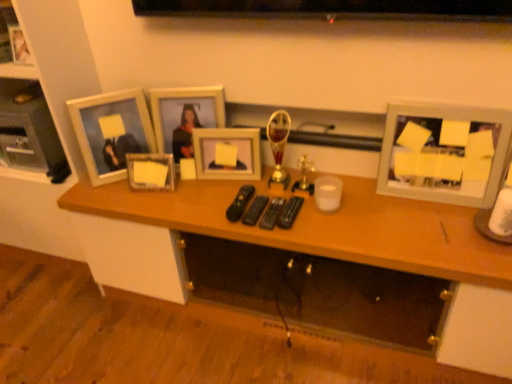
The width and height of the screenshot is (512, 384). What are the coordinates of `black plastic remote control at center, which appears as the 2th remote control when viewed from the left` in the screenshot? It's located at pyautogui.click(x=255, y=210).

The width and height of the screenshot is (512, 384). What do you see at coordinates (445, 153) in the screenshot? I see `white matte picture frame at upper right, which ranks as the 1th picture frame in right-to-left order` at bounding box center [445, 153].

The width and height of the screenshot is (512, 384). I want to click on white matte picture frame at upper right, which ranks as the 1th picture frame in right-to-left order, so click(x=445, y=153).

Image resolution: width=512 pixels, height=384 pixels. Describe the element at coordinates (228, 146) in the screenshot. I see `matte glass picture frame at center, positioned as the second picture frame in right-to-left order` at that location.

Identify the location of wooden picture frame at center, which is the third picture frame in left-to-right order. This screenshot has height=384, width=512. (150, 171).

What do you see at coordinates (185, 116) in the screenshot? This screenshot has height=384, width=512. I see `wooden photo frame at center, the 3th picture frame in the right-to-left sequence` at bounding box center [185, 116].

Locate an element on the screen. This screenshot has width=512, height=384. matte silver picture frame at upper left, acting as the 1th picture frame starting from the left is located at coordinates (19, 46).

Locate an element on the screen. black plastic remote control at center, which appears as the 2th remote control when viewed from the left is located at coordinates (255, 210).

Is white matte picture frame at upper right, which ranks as the 1th picture frame in right-to-left order, not close to white matte picture frame at upper left, the second picture frame viewed from the left?

white matte picture frame at upper right, which ranks as the 1th picture frame in right-to-left order, is actually quite close to white matte picture frame at upper left, the second picture frame viewed from the left.

Does white matte picture frame at upper right, which ranks as the sixth picture frame in left-to-right order, have a larger size compared to white matte picture frame at upper left, the second picture frame viewed from the left?

Indeed, white matte picture frame at upper right, which ranks as the sixth picture frame in left-to-right order, has a larger size compared to white matte picture frame at upper left, the second picture frame viewed from the left.

Does white matte picture frame at upper right, which ranks as the sixth picture frame in left-to-right order, have a greater width compared to white matte picture frame at upper left, the second picture frame viewed from the left?

Yes.

Which of these two, black plastic remote control at center, which is the third remote control from left to right, or wooden desk at center, is smaller?

With smaller size is black plastic remote control at center, which is the third remote control from left to right.

Between point (272, 229) and point (456, 256), which one is positioned behind?

The point (272, 229) is behind.

Based on the photo, from a real-world perspective, is black plastic remote control at center, the 2th remote control when ordered from right to left, over wooden desk at center?

Correct, in the physical world, black plastic remote control at center, the 2th remote control when ordered from right to left, is higher than wooden desk at center.

Consider the image. Considering the sizes of black plastic remote control at center, which is the third remote control from left to right, and wooden desk at center in the image, is black plastic remote control at center, which is the third remote control from left to right, taller or shorter than wooden desk at center?

black plastic remote control at center, which is the third remote control from left to right, is shorter than wooden desk at center.

From the image's perspective, between white matte picture frame at upper left, arranged as the fifth picture frame when viewed from the right, and black plastic remote control at center, placed as the fourth remote control when sorted from left to right, which one is located above?

From the image's view, white matte picture frame at upper left, arranged as the fifth picture frame when viewed from the right, is above.

Which object is further away from the camera taking this photo, white matte picture frame at upper left, the second picture frame viewed from the left, or black plastic remote control at center, which ranks as the 1th remote control in right-to-left order?

white matte picture frame at upper left, the second picture frame viewed from the left, is more distant.

How far apart are white matte picture frame at upper left, arranged as the fifth picture frame when viewed from the right, and black plastic remote control at center, placed as the fourth remote control when sorted from left to right?

white matte picture frame at upper left, arranged as the fifth picture frame when viewed from the right, is 26.92 inches away from black plastic remote control at center, placed as the fourth remote control when sorted from left to right.

Is white matte picture frame at upper left, arranged as the fifth picture frame when viewed from the right, looking in the opposite direction of black plastic remote control at center, which ranks as the 1th remote control in right-to-left order?

No.

Identify the location of the 2nd remote control to the right of the white matte picture frame at upper left, the second picture frame viewed from the left, starting your count from the anchor. (255, 210).

Consider the image. From a real-world perspective, relative to white matte picture frame at upper left, the second picture frame viewed from the left, is black plastic remote control at center, which appears as the 2th remote control when viewed from the left, vertically above or below?

black plastic remote control at center, which appears as the 2th remote control when viewed from the left, is situated lower than white matte picture frame at upper left, the second picture frame viewed from the left, in the real world.

Is black plastic remote control at center, which appears as the 2th remote control when viewed from the left, positioned before white matte picture frame at upper left, the second picture frame viewed from the left?

Yes, black plastic remote control at center, which appears as the 2th remote control when viewed from the left, is closer to the camera.

Considering the positions of objects matte silver picture frame at upper left, acting as the 1th picture frame starting from the left, and black glossy television at upper center in the image provided, who is more to the left, matte silver picture frame at upper left, acting as the 1th picture frame starting from the left, or black glossy television at upper center?

matte silver picture frame at upper left, acting as the 1th picture frame starting from the left.

The image size is (512, 384). What are the coordinates of `the 5th picture frame counting from the left side of the black glossy television at upper center` in the screenshot? It's located at (19, 46).

Do you think matte silver picture frame at upper left, acting as the 1th picture frame starting from the left, is within black glossy television at upper center, or outside of it?

matte silver picture frame at upper left, acting as the 1th picture frame starting from the left, exists outside the volume of black glossy television at upper center.

From the image's perspective, who appears lower, matte silver picture frame at upper left, acting as the 1th picture frame starting from the left, or black glossy television at upper center?

black glossy television at upper center, from the image's perspective.

Can you confirm if black plastic remote control at center, which appears as the 2th remote control when viewed from the left, is taller than white matte picture frame at upper right, which ranks as the 1th picture frame in right-to-left order?

In fact, black plastic remote control at center, which appears as the 2th remote control when viewed from the left, may be shorter than white matte picture frame at upper right, which ranks as the 1th picture frame in right-to-left order.

What's the angular difference between black plastic remote control at center, which is the third remote control in right-to-left order, and white matte picture frame at upper right, which ranks as the 1th picture frame in right-to-left order,'s facing directions?

The angular difference between black plastic remote control at center, which is the third remote control in right-to-left order, and white matte picture frame at upper right, which ranks as the 1th picture frame in right-to-left order, is 0.0973 degrees.

Which of these two, black plastic remote control at center, which appears as the 2th remote control when viewed from the left, or white matte picture frame at upper right, which ranks as the 1th picture frame in right-to-left order, is bigger?

With larger size is white matte picture frame at upper right, which ranks as the 1th picture frame in right-to-left order.

Can you confirm if white matte picture frame at upper left, arranged as the fifth picture frame when viewed from the right, is taller than wooden picture frame at center, which is the third picture frame in left-to-right order?

Yes.

Starting from the wooden picture frame at center, which is the third picture frame in left-to-right order, which picture frame is the 1st one to the left? Please provide its 2D coordinates.

[(111, 132)]

Which of these two, white matte picture frame at upper left, arranged as the fifth picture frame when viewed from the right, or wooden picture frame at center, which is the third picture frame in left-to-right order, is wider?

Wider between the two is white matte picture frame at upper left, arranged as the fifth picture frame when viewed from the right.

From a real-world perspective, which picture frame is the 1st one above the white matte picture frame at upper left, the second picture frame viewed from the left? Please provide its 2D coordinates.

[(445, 153)]

Starting from the wooden desk at center, which remote control is the 2nd one to the left? Please provide its 2D coordinates.

[(272, 213)]

Which object lies nearer to the anchor point black plastic remote control at center, which is the third remote control from left to right, wooden photo frame at center, the 3th picture frame in the right-to-left sequence, or black plastic remote control at center, which appears as the 2th remote control when viewed from the left?

black plastic remote control at center, which appears as the 2th remote control when viewed from the left, is positioned closer to the anchor black plastic remote control at center, which is the third remote control from left to right.

Estimate the real-world distances between objects in this image. Which object is closer to wooden photo frame at center, which is counted as the 4th picture frame, starting from the left, black plastic remote at center, positioned as the 1th remote control in left-to-right order, or black plastic remote control at center, which is the third remote control from left to right?

Among the two, black plastic remote at center, positioned as the 1th remote control in left-to-right order, is located nearer to wooden photo frame at center, which is counted as the 4th picture frame, starting from the left.

Looking at the image, which one is located further to white matte picture frame at upper right, which ranks as the 1th picture frame in right-to-left order, wooden photo frame at center, the 3th picture frame in the right-to-left sequence, or matte silver picture frame at upper left, acting as the 1th picture frame starting from the left?

matte silver picture frame at upper left, acting as the 1th picture frame starting from the left, is further to white matte picture frame at upper right, which ranks as the 1th picture frame in right-to-left order.

From the image, which object appears to be farther from black plastic remote control at center, which appears as the 2th remote control when viewed from the left, white matte picture frame at upper left, arranged as the fifth picture frame when viewed from the right, or wooden picture frame at center, the 4th picture frame in the right-to-left sequence?

Among the two, white matte picture frame at upper left, arranged as the fifth picture frame when viewed from the right, is located further to black plastic remote control at center, which appears as the 2th remote control when viewed from the left.

From the image, which object appears to be farther from black glossy television at upper center, black plastic remote control at center, placed as the fourth remote control when sorted from left to right, or black plastic remote at center, arranged as the fourth remote control when viewed from the right?

black plastic remote at center, arranged as the fourth remote control when viewed from the right, is positioned further to the anchor black glossy television at upper center.

Looking at this image, when comparing their distances from wooden picture frame at center, which is the third picture frame in left-to-right order, does black plastic remote control at center, which ranks as the 1th remote control in right-to-left order, or white matte picture frame at upper right, which ranks as the 1th picture frame in right-to-left order, seem closer?

The object closer to wooden picture frame at center, which is the third picture frame in left-to-right order, is black plastic remote control at center, which ranks as the 1th remote control in right-to-left order.

Estimate the real-world distances between objects in this image. Which object is closer to black plastic remote control at center, which ranks as the 1th remote control in right-to-left order, wooden desk at center or black plastic remote control at center, which appears as the 2th remote control when viewed from the left?

black plastic remote control at center, which appears as the 2th remote control when viewed from the left, is closer to black plastic remote control at center, which ranks as the 1th remote control in right-to-left order.

Estimate the real-world distances between objects in this image. Which object is further from black plastic remote control at center, which ranks as the 1th remote control in right-to-left order, black plastic remote control at center, which is the third remote control from left to right, or matte glass picture frame at center, positioned as the second picture frame in right-to-left order?

matte glass picture frame at center, positioned as the second picture frame in right-to-left order, is positioned further to the anchor black plastic remote control at center, which ranks as the 1th remote control in right-to-left order.

Where is `desk between black plastic remote at center, positioned as the 1th remote control in left-to-right order, and white matte picture frame at upper right, which ranks as the 1th picture frame in right-to-left order`? The height and width of the screenshot is (384, 512). desk between black plastic remote at center, positioned as the 1th remote control in left-to-right order, and white matte picture frame at upper right, which ranks as the 1th picture frame in right-to-left order is located at coordinates (323, 227).

I want to click on picture frame between wooden photo frame at center, the 3th picture frame in the right-to-left sequence, and black plastic remote control at center, placed as the fourth remote control when sorted from left to right, so click(228, 146).

Locate an element on the screen. This screenshot has height=384, width=512. desk between wooden photo frame at center, which is counted as the 4th picture frame, starting from the left, and white matte picture frame at upper right, which ranks as the 1th picture frame in right-to-left order, in the horizontal direction is located at coordinates (323, 227).

This screenshot has width=512, height=384. What are the coordinates of `picture frame located between matte silver picture frame at upper left, acting as the 1th picture frame starting from the left, and wooden picture frame at center, the 4th picture frame in the right-to-left sequence, in the left-right direction` in the screenshot? It's located at (111, 132).